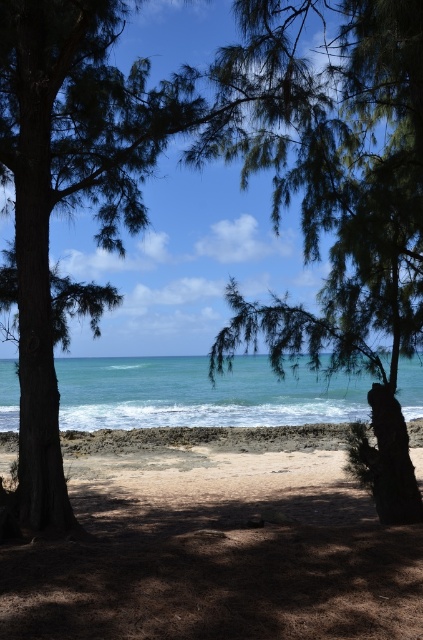
Does brown sandy beach at center come behind green leafy tree at center?

No, brown sandy beach at center is closer to the viewer.

Which is more to the right, brown sandy beach at center or green leafy tree at center?

Positioned to the right is green leafy tree at center.

Between point (398, 621) and point (395, 93), which one is positioned behind?

Point (395, 93)

Identify the location of brown sandy beach at center. (216, 548).

Between brown sandy beach at center and blue water at center, which one is positioned higher?

blue water at center is higher up.

Which is in front, point (335, 458) or point (353, 392)?

Positioned in front is point (335, 458).

Identify the location of brown sandy beach at center. (216, 548).

Who is more distant from viewer, [345,179] or [189,420]?

Point [189,420]

Can you confirm if green leafy tree at center is bigger than blue water at center?

Actually, green leafy tree at center might be smaller than blue water at center.

Between point (395, 100) and point (189, 396), which one is positioned in front?

Point (395, 100) is more forward.

At what (x,y) coordinates should I click in order to perform the action: click on green leafy tree at center. Please return your answer as a coordinate pair (x, y). The width and height of the screenshot is (423, 640). Looking at the image, I should click on (342, 205).